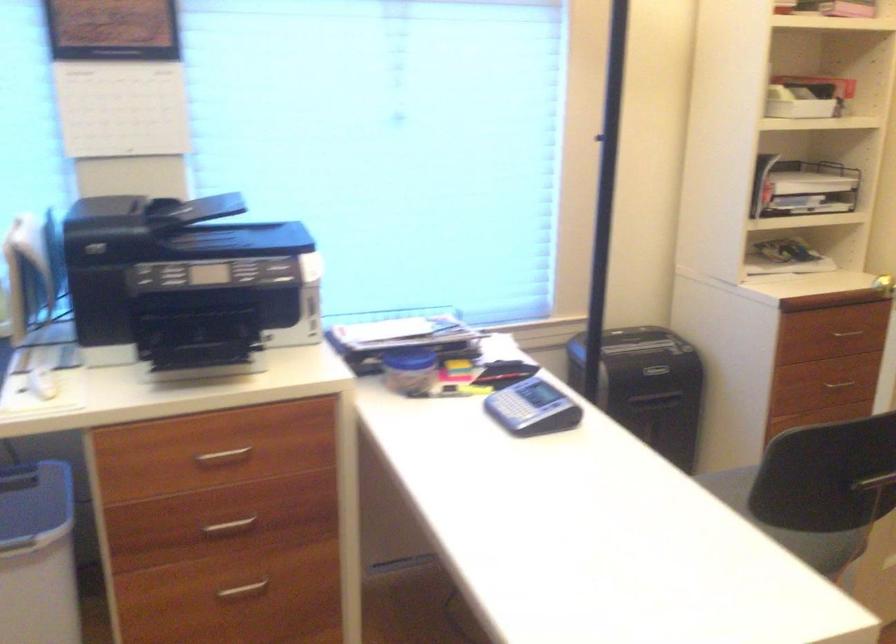
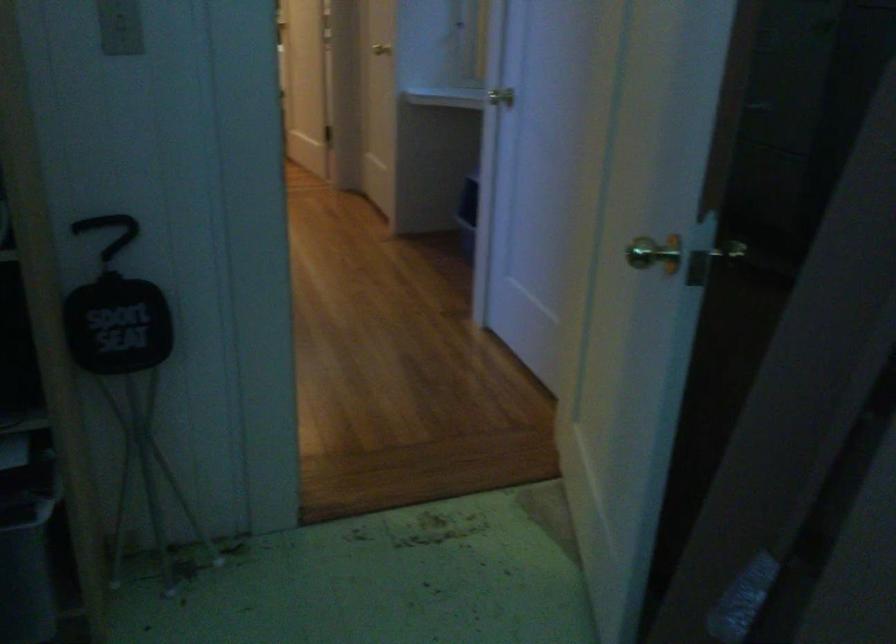
Question: I am providing you with two images of the same scene from different viewpoints. After the viewpoint changes to image2, which objects are now occluded?

Choices:
 (A) small clear bottle
 (B) chair sitting surface
 (C) seat handle
 (D) blue waste bin

Answer: (D)